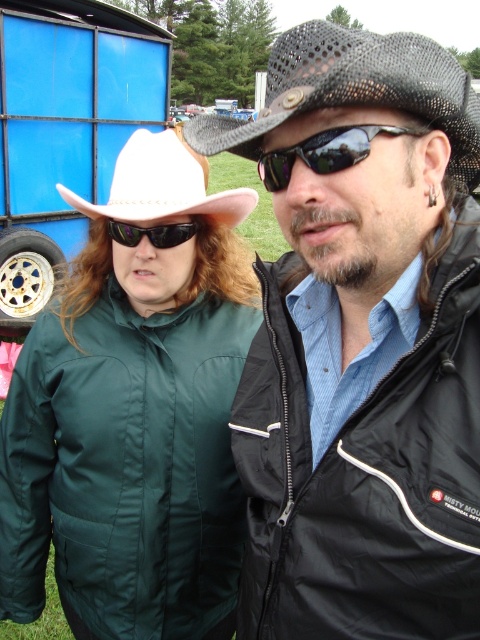
Question: Does green matte jacket at center have a lesser width compared to black mesh fedora at upper center?

Choices:
 (A) no
 (B) yes

Answer: (B)

Question: Which is farther from the black plastic sunglasses at left?

Choices:
 (A) black mesh hat at upper center
 (B) black mesh fedora at upper center
 (C) sunglasses at center
 (D) white felt cowboy hat at upper left

Answer: (B)

Question: Is black mesh fedora at upper center below black plastic sunglasses at left?

Choices:
 (A) no
 (B) yes

Answer: (A)

Question: Estimate the real-world distances between objects in this image. Which object is closer to the white felt cowboy hat at upper left?

Choices:
 (A) black mesh fedora at upper center
 (B) green matte jacket at center
 (C) black plastic sunglasses at left
 (D) black mesh hat at upper center

Answer: (C)

Question: Can you confirm if black mesh fedora at upper center is positioned above black plastic sunglasses at left?

Choices:
 (A) no
 (B) yes

Answer: (B)

Question: Which of the following is the farthest from the observer?

Choices:
 (A) (354, 147)
 (B) (130, 410)

Answer: (B)